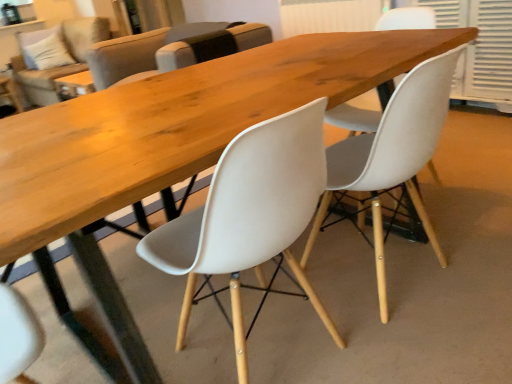
Question: Is white plastic chair at center, the 2th chair viewed from the front, to the left of white plastic chair at center, acting as the first chair starting from the back, from the viewer's perspective?

Choices:
 (A) yes
 (B) no

Answer: (B)

Question: Is white plastic chair at center, the 2th chair viewed from the front, not inside white plastic chair at center, acting as the first chair starting from the back?

Choices:
 (A) yes
 (B) no

Answer: (A)

Question: From a real-world perspective, is white plastic chair at center, which is the 2th chair in back-to-front order, physically below white plastic chair at center, which is the 3th chair from front to back?

Choices:
 (A) yes
 (B) no

Answer: (A)

Question: Does white plastic chair at center, which is the 2th chair in back-to-front order, have a larger size compared to white plastic chair at center, which is the 3th chair from front to back?

Choices:
 (A) no
 (B) yes

Answer: (A)

Question: Is white plastic chair at center, the 2th chair viewed from the front, behind white plastic chair at center, acting as the first chair starting from the back?

Choices:
 (A) no
 (B) yes

Answer: (A)

Question: In terms of size, does white plastic chair at center, which is the 2th chair in back-to-front order, appear bigger or smaller than beige fabric couch at upper left?

Choices:
 (A) small
 (B) big

Answer: (A)

Question: Considering the positions of white plastic chair at center, the 2th chair viewed from the front, and beige fabric couch at upper left in the image, is white plastic chair at center, the 2th chair viewed from the front, taller or shorter than beige fabric couch at upper left?

Choices:
 (A) tall
 (B) short

Answer: (B)

Question: Considering their positions, is white plastic chair at center, which is the 2th chair in back-to-front order, located in front of or behind beige fabric couch at upper left?

Choices:
 (A) behind
 (B) front

Answer: (B)

Question: From the image's perspective, is white plastic chair at center, the 2th chair viewed from the front, above or below beige fabric couch at upper left?

Choices:
 (A) below
 (B) above

Answer: (A)

Question: Choose the correct answer: Is beige fabric couch at upper left inside white plastic chair at center, which is the 2th chair in back-to-front order, or outside it?

Choices:
 (A) inside
 (B) outside

Answer: (B)

Question: Looking at their shapes, would you say beige fabric couch at upper left is wider or thinner than white plastic chair at center, the 2th chair viewed from the front?

Choices:
 (A) wide
 (B) thin

Answer: (A)

Question: Relative to white plastic chair at center, the 2th chair viewed from the front, is beige fabric couch at upper left in front or behind?

Choices:
 (A) front
 (B) behind

Answer: (B)

Question: From a real-world perspective, is beige fabric couch at upper left positioned above or below white plastic chair at center, the 2th chair viewed from the front?

Choices:
 (A) above
 (B) below

Answer: (A)

Question: In terms of height, does matte white chair at center, which is the first chair from front to back, look taller or shorter compared to white textured shutter at upper right?

Choices:
 (A) short
 (B) tall

Answer: (B)

Question: Is matte white chair at center, acting as the 3th chair starting from the back, wider or thinner than white textured shutter at upper right?

Choices:
 (A) wide
 (B) thin

Answer: (A)